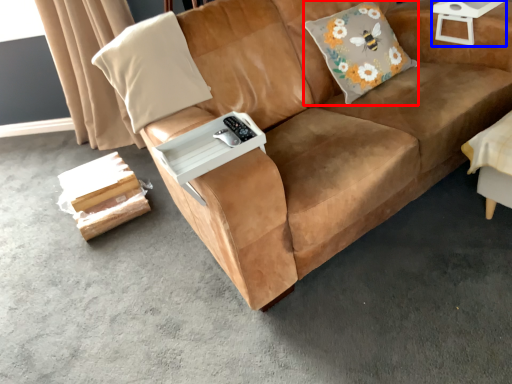
Question: Which object is closer to the camera taking this photo, throw pillow (highlighted by a red box) or side table (highlighted by a blue box)?

Choices:
 (A) throw pillow
 (B) side table

Answer: (A)